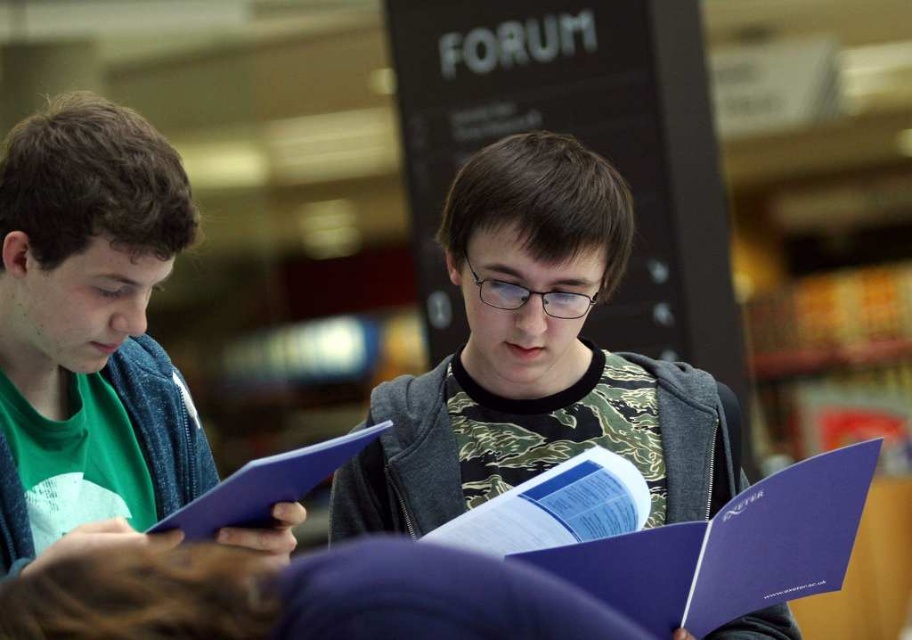
Does point (731, 525) lie behind point (375, 435)?

Yes.

In the scene shown: Measure the distance between point (861, 486) and camera.

The distance of point (861, 486) from camera is 4.93 feet.

Is point (703, 547) farther from camera compared to point (255, 468)?

Yes, point (703, 547) is behind point (255, 468).

Image resolution: width=912 pixels, height=640 pixels. In order to click on purple paper folder at center in this screenshot , I will do `click(729, 548)`.

Does camouflage-patterned shirt at center have a smaller size compared to matte blue folder at center?

No.

Who is more forward, [636,362] or [315,451]?

Positioned in front is point [315,451].

This screenshot has width=912, height=640. I want to click on camouflage-patterned shirt at center, so click(x=536, y=360).

Which is above, matte blue folder at left or matte blue folder at center?

matte blue folder at left is above.

Can you confirm if matte blue folder at left is positioned above matte blue folder at center?

Yes, matte blue folder at left is above matte blue folder at center.

The width and height of the screenshot is (912, 640). What do you see at coordinates (90, 324) in the screenshot?
I see `matte blue folder at left` at bounding box center [90, 324].

Locate an element on the screen. matte blue folder at left is located at coordinates (90, 324).